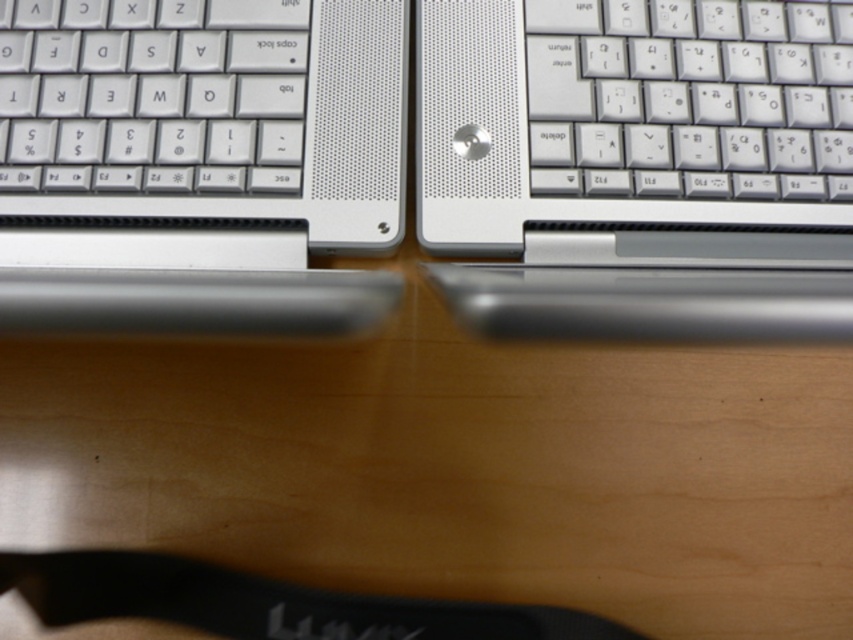
Based on the photo, which is above, white plastic keyboard at upper right or white plastic keyboard at left?

white plastic keyboard at upper right is above.

Is the position of white plastic keyboard at upper right less distant than that of white plastic keyboard at left?

No.

The width and height of the screenshot is (853, 640). What do you see at coordinates (689, 99) in the screenshot? I see `white plastic keyboard at upper right` at bounding box center [689, 99].

Where is `white plastic keyboard at upper right`? The image size is (853, 640). white plastic keyboard at upper right is located at coordinates (689, 99).

Does point (474, 164) lie behind point (206, 92)?

No, it is in front of (206, 92).

Does satin silver keyboard at center have a smaller size compared to white plastic keyboard at left?

Actually, satin silver keyboard at center might be larger than white plastic keyboard at left.

Where is `satin silver keyboard at center`? Image resolution: width=853 pixels, height=640 pixels. satin silver keyboard at center is located at coordinates (639, 166).

Locate an element on the screen. The image size is (853, 640). satin silver keyboard at center is located at coordinates (639, 166).

Which of these two, satin silver laptop at left or white plastic keyboard at left, stands shorter?

white plastic keyboard at left is shorter.

Between point (202, 252) and point (218, 93), which one is positioned behind?

Positioned behind is point (218, 93).

Image resolution: width=853 pixels, height=640 pixels. Identify the location of satin silver laptop at left. (198, 163).